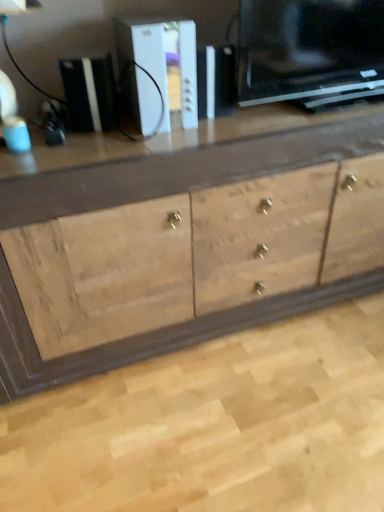
This screenshot has height=512, width=384. I want to click on vacant region in front of white plastic gaming console at upper center, the 1th appliance when ordered from left to right, so click(x=91, y=149).